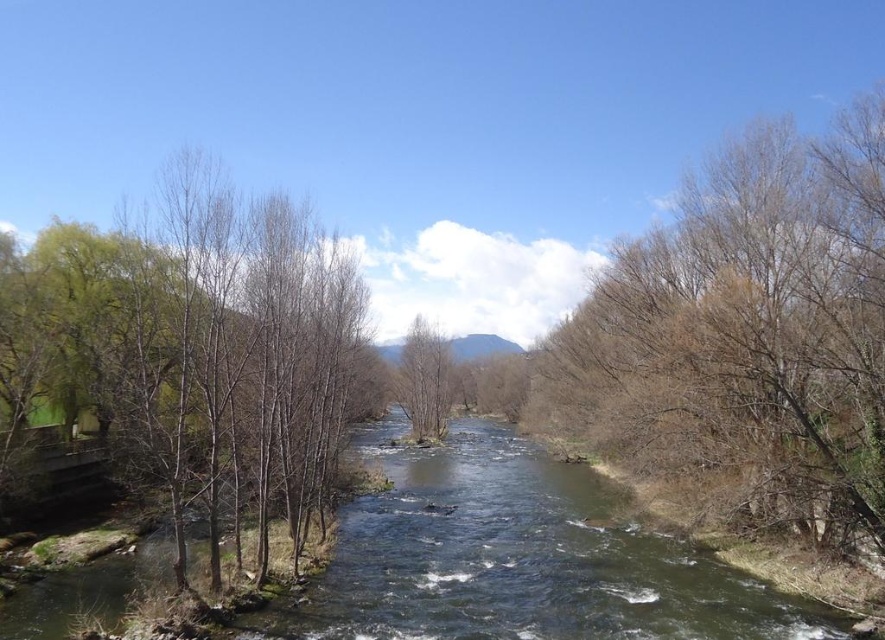
Question: Does bare branches at right have a greater width compared to green leafy tree at left?

Choices:
 (A) no
 (B) yes

Answer: (A)

Question: Which object is farther from the camera taking this photo?

Choices:
 (A) bare wood tree at center
 (B) green leafy tree at left

Answer: (A)

Question: Estimate the real-world distances between objects in this image. Which object is farther from the bare branches at right?

Choices:
 (A) green leafy tree at left
 (B) bare wood tree at center

Answer: (B)

Question: Is bare branches at right closer to camera compared to green leafy tree at left?

Choices:
 (A) yes
 (B) no

Answer: (B)

Question: Does green leafy tree at left appear on the left side of bare wood tree at center?

Choices:
 (A) yes
 (B) no

Answer: (A)

Question: Considering the real-world distances, which object is farthest from the bare branches at right?

Choices:
 (A) bare wood tree at center
 (B) green leafy tree at left

Answer: (A)